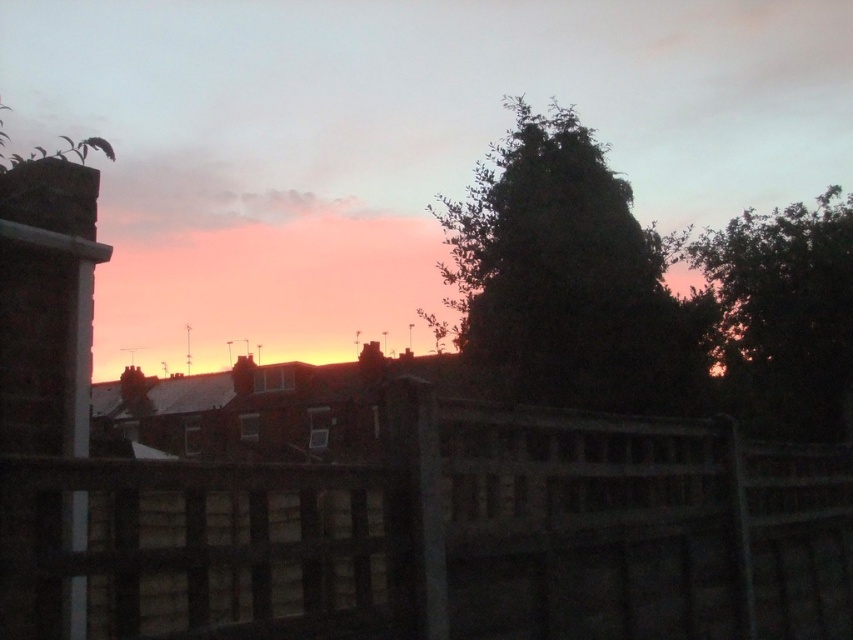
Question: Which object is positioned farthest from the dark green leafy tree at upper right?

Choices:
 (A) brown wooden fence at lower center
 (B) dark green leafy tree at center

Answer: (A)

Question: In this image, where is brown wooden fence at lower center located relative to dark green leafy tree at upper right?

Choices:
 (A) below
 (B) above

Answer: (A)

Question: Based on their relative distances, which object is nearer to the dark green leafy tree at upper right?

Choices:
 (A) brown wooden fence at lower center
 (B) dark green leafy tree at center

Answer: (B)

Question: Which point appears closest to the camera in this image?

Choices:
 (A) (544, 344)
 (B) (201, 536)

Answer: (B)

Question: In this image, where is brown wooden fence at lower center located relative to dark green leafy tree at center?

Choices:
 (A) below
 (B) above

Answer: (A)

Question: Does brown wooden fence at lower center have a greater width compared to dark green leafy tree at center?

Choices:
 (A) yes
 (B) no

Answer: (B)